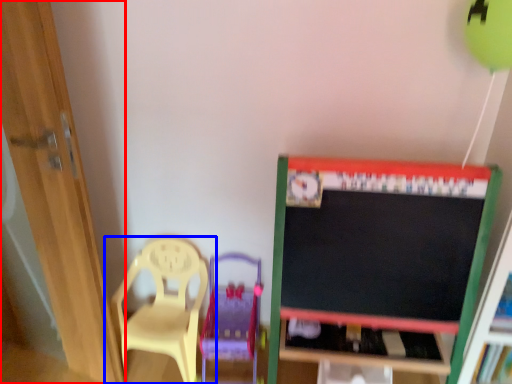
Question: Which object is further to the camera taking this photo, door (highlighted by a red box) or chair (highlighted by a blue box)?

Choices:
 (A) door
 (B) chair

Answer: (B)